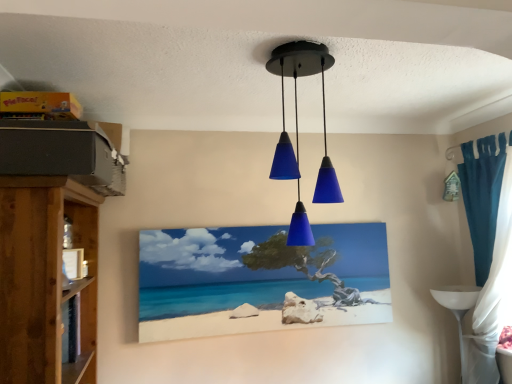
Question: Does point (74, 254) appear closer or farther from the camera than point (223, 302)?

Choices:
 (A) farther
 (B) closer

Answer: (B)

Question: In the image, is white matte picture frame at left, which is the 2th picture frame from back to front, positioned in front of or behind matte canvas painting at center, which appears as the 1th picture frame when viewed from the right?

Choices:
 (A) behind
 (B) front

Answer: (B)

Question: Estimate the real-world distances between objects in this image. Which object is closer to the white matte picture frame at left, the 1th picture frame in the front-to-back sequence?

Choices:
 (A) matte canvas painting at center, arranged as the 2th picture frame when viewed from the left
 (B) matte blue glass pendant lights at center
 (C) wooden shelf at left
 (D) teal fabric curtain at right
 (E) white glossy table at lower right

Answer: (C)

Question: Estimate the real-world distances between objects in this image. Which object is farther from the white matte picture frame at left, the 1th picture frame in the front-to-back sequence?

Choices:
 (A) matte blue glass pendant lights at center
 (B) matte canvas painting at center, which appears as the 1th picture frame when viewed from the right
 (C) wooden shelf at left
 (D) white glossy table at lower right
 (E) teal fabric curtain at right

Answer: (E)